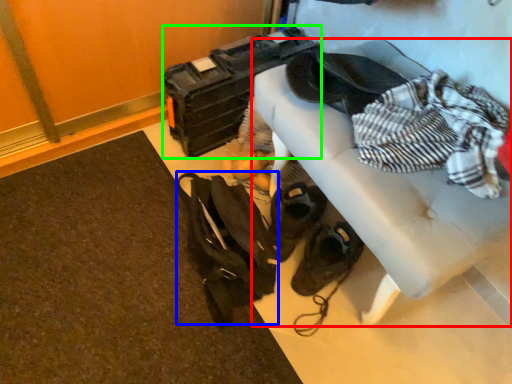
Question: Based on their relative distances, which object is farther from furniture (highlighted by a red box)? Choose from messenger bag (highlighted by a blue box) and luggage (highlighted by a green box).

Choices:
 (A) messenger bag
 (B) luggage

Answer: (B)